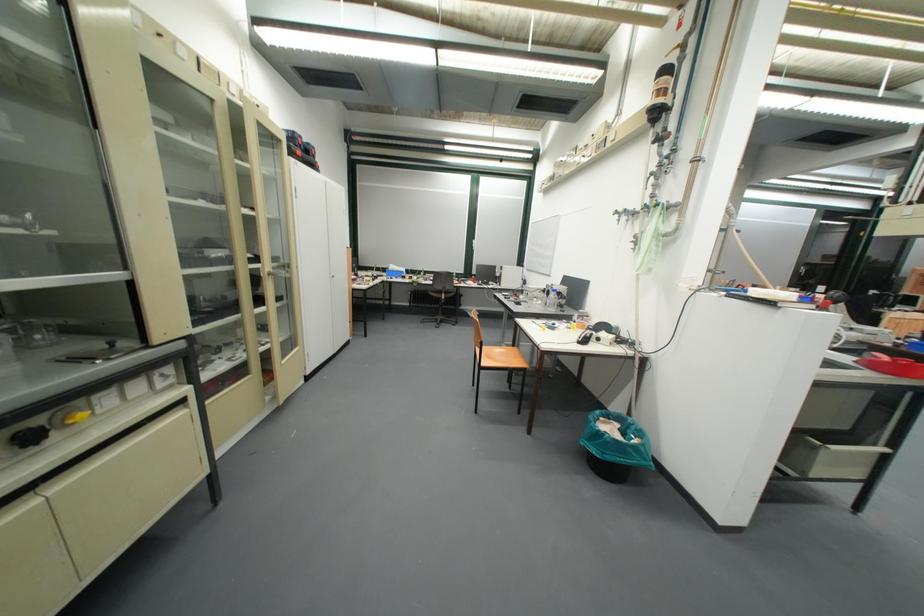
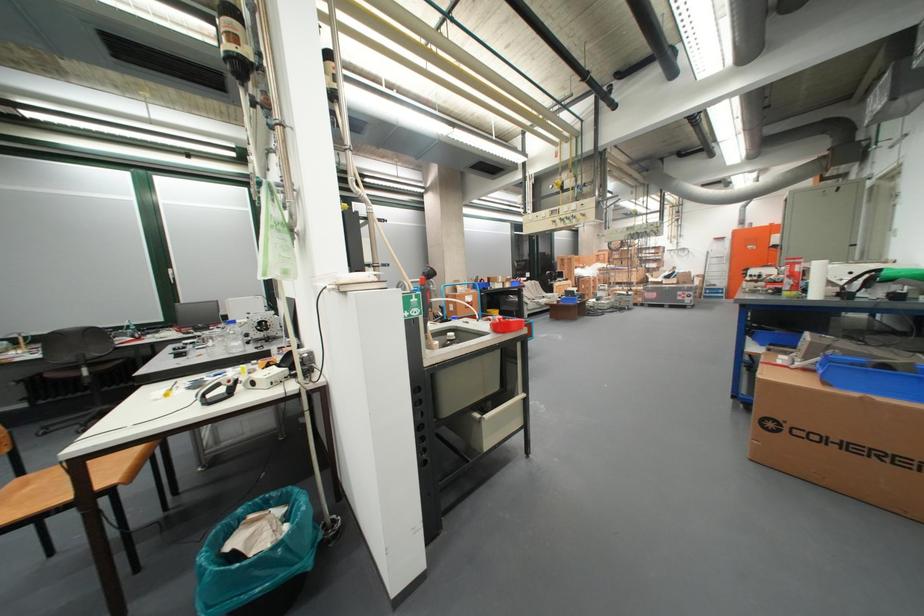
In the second image, find the point that corresponds to point 629,426 in the first image.

(293, 512)